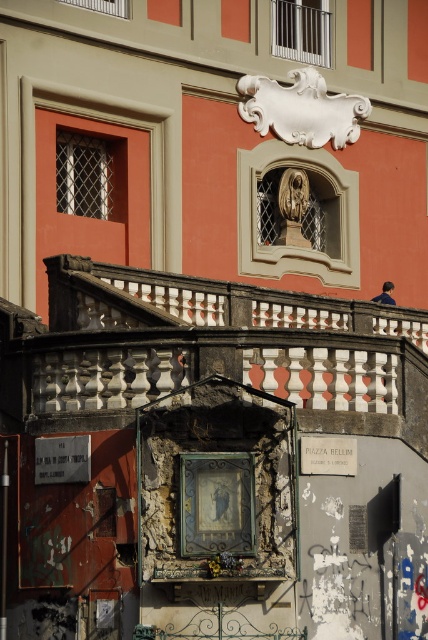
What are the coordinates of the metallic gold clock at center?

The metallic gold clock at center is located at coordinates point (x=216, y=502).

You are an architect examining the building facade. You notice two plaques on the wall. Which one is bigger between the white stone plaque at lower left and the white matte plaque at center?

The white stone plaque at lower left is larger in size than the white matte plaque at center.

You are an architect assessing the building facade. The metallic gold clock at center and the white stone plaque at lower left are both candidates for potential modifications. Which object has a greater width, requiring more material for any adjustments?

Result: The metallic gold clock at center has a greater width than the white stone plaque at lower left, so it requires more material for adjustments.